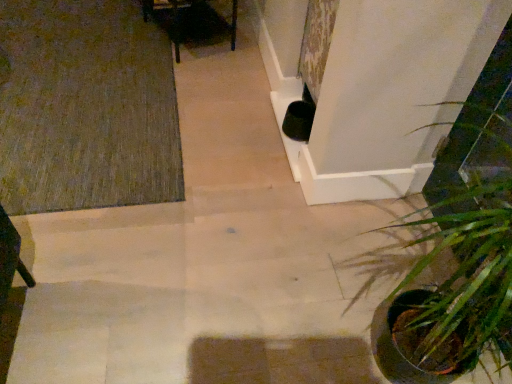
Locate an element on the screen. Image resolution: width=512 pixels, height=384 pixels. blank area beneath green textured rug at upper left (from a real-world perspective) is located at coordinates (71, 77).